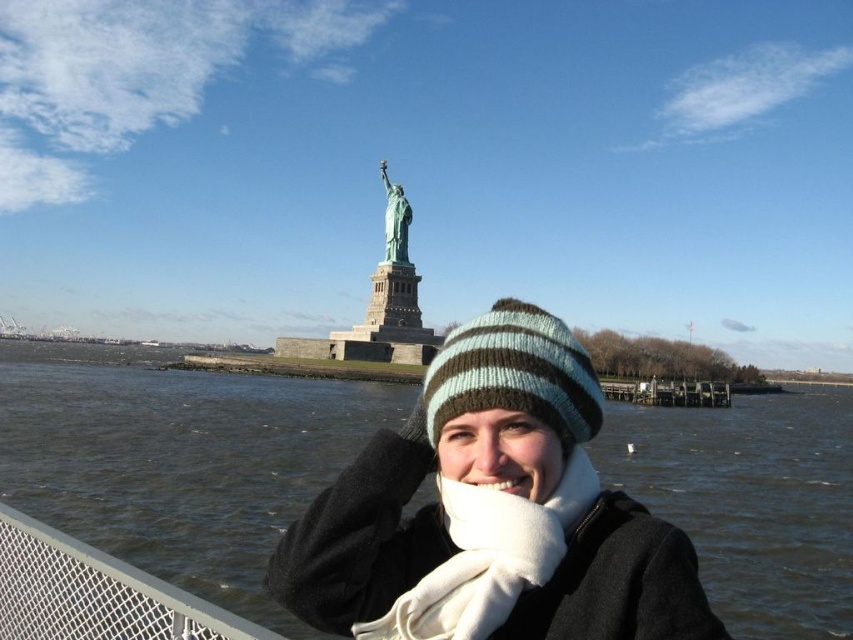
Looking at this image, you are standing at the center of the image and want to place a small gift box exactly where the striped knit beanie at center is located. What are the coordinates you should aim for?

The coordinates for the striped knit beanie at center are at point (511, 374).

You are standing at the base of the Statue of Liberty and want to take a photo of the smooth skin nose at center and the green patina statue at center in the same frame. Given that your camera has a maximum focal length that allows capturing objects up to 300 feet apart in the same shot, will you be able to include both in your photo?

The smooth skin nose at center and the green patina statue at center are 303.98 feet apart from each other. Since the distance exceeds the camera maximum focal length limit of 300 feet, you will not be able to capture both in the same frame.

You are a photographer trying to capture both the striped knit beanie at center and the green patina statue at center in a single frame. Given their sizes, which object will appear bigger in your photo?

The striped knit beanie at center will appear bigger in the photo because it is larger in size than the green patina statue at center.